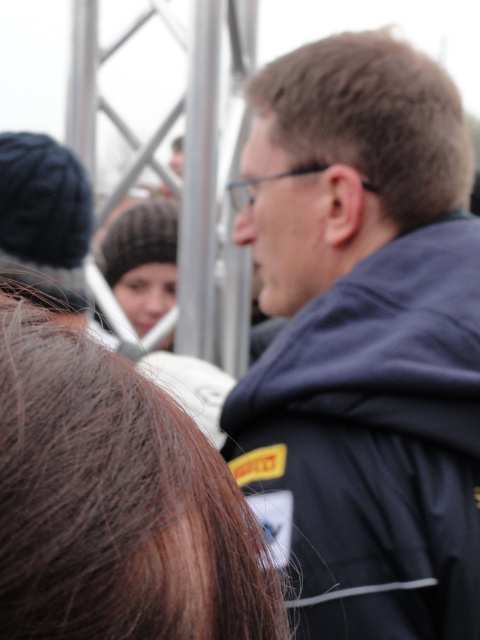
Can you confirm if dark blue jacket at upper right is thinner than brown matte hair at upper center?

No, dark blue jacket at upper right is not thinner than brown matte hair at upper center.

Does dark blue jacket at upper right appear on the right side of brown matte hair at upper center?

In fact, dark blue jacket at upper right is to the left of brown matte hair at upper center.

Which is behind, point (357, 72) or point (326, 104)?

Point (326, 104)

This screenshot has width=480, height=640. I want to click on dark blue jacket at upper right, so click(x=362, y=340).

Is brownhair at upper right below knitted woolen hat at center?

Yes, brownhair at upper right is below knitted woolen hat at center.

Is brownhair at upper right further to camera compared to knitted woolen hat at center?

That is False.

This screenshot has height=640, width=480. Find the location of `brownhair at upper right`. brownhair at upper right is located at coordinates (116, 502).

Can you confirm if dark blue jacket at upper right is wider than knitted woolen hat at center?

Correct, the width of dark blue jacket at upper right exceeds that of knitted woolen hat at center.

Who is lower down, dark blue jacket at upper right or knitted woolen hat at center?

Positioned lower is dark blue jacket at upper right.

This screenshot has width=480, height=640. I want to click on dark blue jacket at upper right, so click(362, 340).